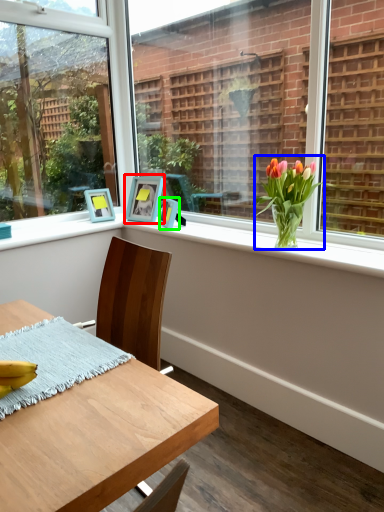
Question: Based on their relative distances, which object is farther from picture frame (highlighted by a red box)? Choose from houseplant (highlighted by a blue box) and picture frame (highlighted by a green box).

Choices:
 (A) houseplant
 (B) picture frame

Answer: (A)